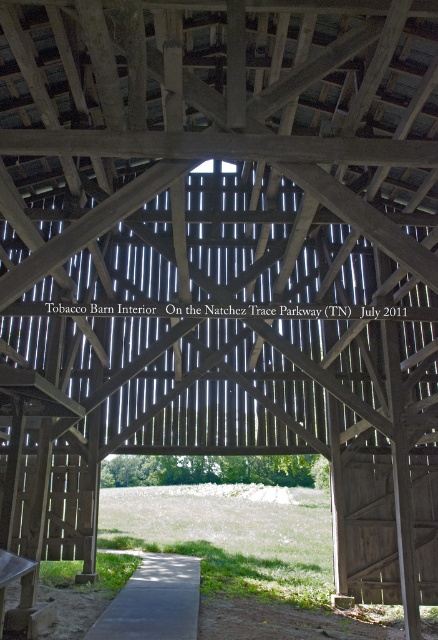
You are standing on the gray concrete path at center and want to reach the wooden picnic table at lower left. Which direction should you move to get there?

The wooden picnic table at lower left is behind the gray concrete path at center, so you should move backward to reach it.

You are a photographer standing inside the Tobacco Barn and want to take a photo of both point (195, 628) and point (24, 612). Which point is closer to your camera lens?

Point (24, 612) is closer to the camera lens because it is less further away than point (195, 628).